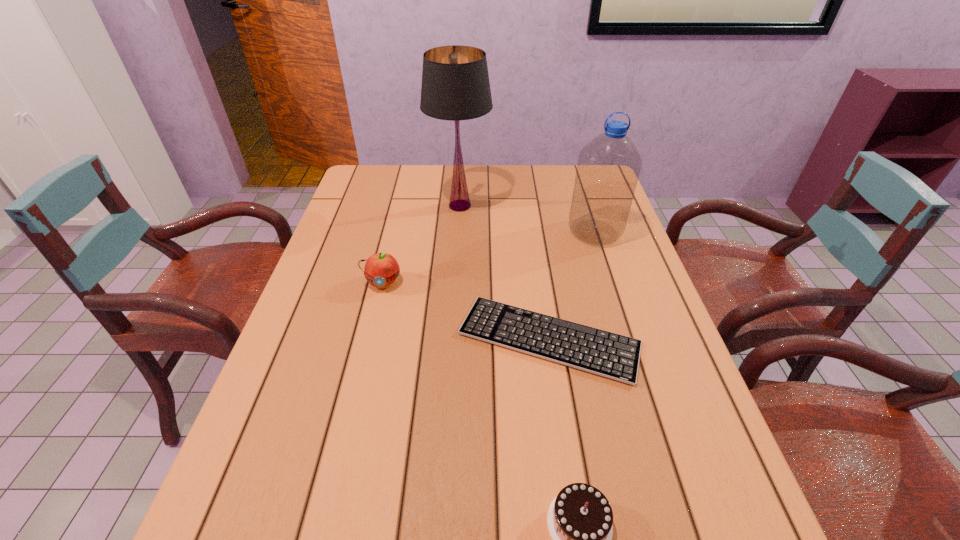
Locate an element on the screen. unoccupied area between the shortest object and the water jug is located at coordinates (572, 286).

Identify which object is the third nearest to the lampshade. Please provide its 2D coordinates. Your answer should be formatted as a tuple, i.e. [(x, y)], where the tuple contains the x and y coordinates of a point satisfying the conditions above.

[(611, 355)]

Locate an element on the screen. Image resolution: width=960 pixels, height=540 pixels. object that is the nearest to the fourth shortest object is located at coordinates (611, 355).

The height and width of the screenshot is (540, 960). I want to click on vacant space that satisfies the following two spatial constraints: 1. on the front-facing side of the lampshade; 2. on the left side of the shortest object, so click(452, 339).

Where is `free space in the image that satisfies the following two spatial constraints: 1. on the back side of the fourth farthest object; 2. on the right side of the fourth shortest object`? This screenshot has height=540, width=960. free space in the image that satisfies the following two spatial constraints: 1. on the back side of the fourth farthest object; 2. on the right side of the fourth shortest object is located at coordinates (x=533, y=232).

Locate an element on the screen. blank area in the image that satisfies the following two spatial constraints: 1. on the front-facing side of the water jug; 2. on the right side of the tallest object is located at coordinates (458, 232).

Where is `blank space that satisfies the following two spatial constraints: 1. on the front side of the apple; 2. on the right side of the fourth farthest object`? The image size is (960, 540). blank space that satisfies the following two spatial constraints: 1. on the front side of the apple; 2. on the right side of the fourth farthest object is located at coordinates (370, 339).